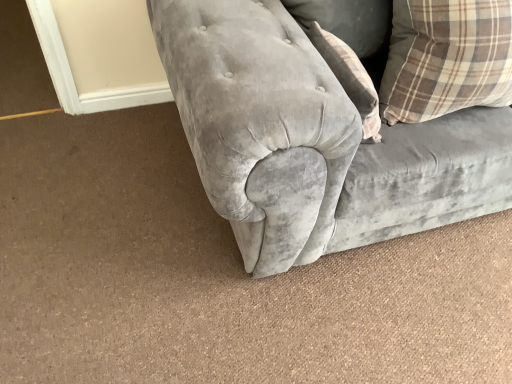
Question: Is brown plaid pillow at upper right shorter than velvet gray couch at center?

Choices:
 (A) no
 (B) yes

Answer: (B)

Question: Considering the relative positions of brown plaid pillow at upper right and velvet gray couch at center in the image provided, is brown plaid pillow at upper right to the right of velvet gray couch at center from the viewer's perspective?

Choices:
 (A) yes
 (B) no

Answer: (B)

Question: Is brown plaid pillow at upper right at the left side of velvet gray couch at center?

Choices:
 (A) no
 (B) yes

Answer: (B)

Question: Is brown plaid pillow at upper right wider than velvet gray couch at center?

Choices:
 (A) yes
 (B) no

Answer: (B)

Question: Can you confirm if brown plaid pillow at upper right is bigger than velvet gray couch at center?

Choices:
 (A) no
 (B) yes

Answer: (A)

Question: From the image's perspective, does brown plaid pillow at upper right appear higher than velvet gray couch at center?

Choices:
 (A) yes
 (B) no

Answer: (B)

Question: Is velvet gray couch at center oriented away from brown plaid pillow at upper right?

Choices:
 (A) yes
 (B) no

Answer: (A)

Question: Is the depth of velvet gray couch at center greater than that of brown plaid pillow at upper right?

Choices:
 (A) yes
 (B) no

Answer: (B)

Question: From the image's perspective, is velvet gray couch at center below brown plaid pillow at upper right?

Choices:
 (A) no
 (B) yes

Answer: (A)

Question: Does velvet gray couch at center contain brown plaid pillow at upper right?

Choices:
 (A) yes
 (B) no

Answer: (A)

Question: Would you consider velvet gray couch at center to be distant from brown plaid pillow at upper right?

Choices:
 (A) yes
 (B) no

Answer: (B)

Question: Can you confirm if velvet gray couch at center is wider than brown plaid pillow at upper right?

Choices:
 (A) yes
 (B) no

Answer: (A)

Question: Based on their sizes in the image, would you say brown plaid pillow at upper right is bigger or smaller than velvet gray couch at center?

Choices:
 (A) small
 (B) big

Answer: (A)